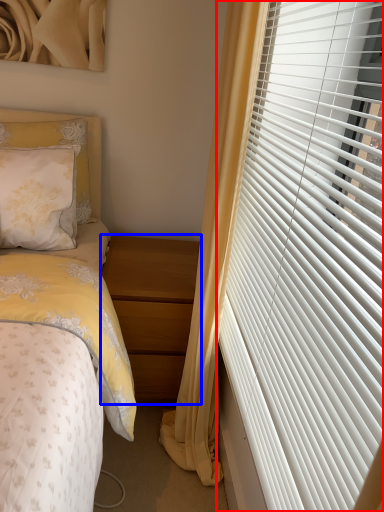
Question: Which object is closer to the camera taking this photo, window blind (highlighted by a red box) or nightstand (highlighted by a blue box)?

Choices:
 (A) window blind
 (B) nightstand

Answer: (A)